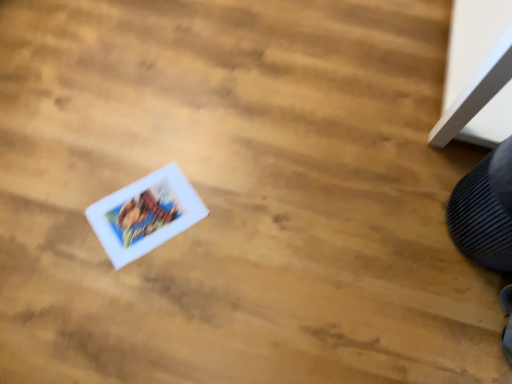
Question: Is white matte comic book at center surrounding black textured shoe at lower right?

Choices:
 (A) yes
 (B) no

Answer: (B)

Question: Could you tell me if white matte comic book at center is facing black textured shoe at lower right?

Choices:
 (A) no
 (B) yes

Answer: (A)

Question: Does white matte comic book at center have a smaller size compared to black textured shoe at lower right?

Choices:
 (A) yes
 (B) no

Answer: (A)

Question: Would you say white matte comic book at center is a long distance from black textured shoe at lower right?

Choices:
 (A) yes
 (B) no

Answer: (B)

Question: From a real-world perspective, is white matte comic book at center positioned under black textured shoe at lower right based on gravity?

Choices:
 (A) no
 (B) yes

Answer: (B)

Question: Can you confirm if white matte comic book at center is positioned to the right of black textured shoe at lower right?

Choices:
 (A) no
 (B) yes

Answer: (A)

Question: Is black textured shoe at lower right taller than white matte comic book at center?

Choices:
 (A) no
 (B) yes

Answer: (B)

Question: Is black textured shoe at lower right aimed at white matte comic book at center?

Choices:
 (A) no
 (B) yes

Answer: (B)

Question: Is black textured shoe at lower right shorter than white matte comic book at center?

Choices:
 (A) no
 (B) yes

Answer: (A)

Question: Is black textured shoe at lower right further to camera compared to white matte comic book at center?

Choices:
 (A) no
 (B) yes

Answer: (A)

Question: From a real-world perspective, does black textured shoe at lower right sit lower than white matte comic book at center?

Choices:
 (A) yes
 (B) no

Answer: (B)

Question: From a real-world perspective, is black textured shoe at lower right on white matte comic book at center?

Choices:
 (A) yes
 (B) no

Answer: (A)

Question: Based on their sizes in the image, would you say black textured shoe at lower right is bigger or smaller than white matte comic book at center?

Choices:
 (A) big
 (B) small

Answer: (A)